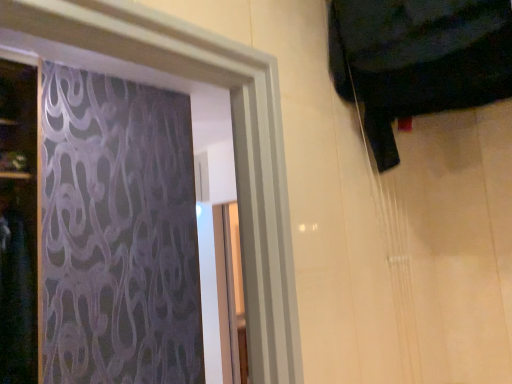
Question: Based on their positions, is black fabric at upper right located to the left or right of dark wood door at left?

Choices:
 (A) right
 (B) left

Answer: (A)

Question: Is point (434, 34) positioned closer to the camera than point (2, 132)?

Choices:
 (A) closer
 (B) farther

Answer: (A)

Question: From the image's perspective, relative to dark wood door at left, is black fabric at upper right above or below?

Choices:
 (A) above
 (B) below

Answer: (A)

Question: In terms of width, does dark wood door at left look wider or thinner when compared to black fabric at upper right?

Choices:
 (A) wide
 (B) thin

Answer: (A)

Question: In the image, is dark wood door at left on the left side or the right side of black fabric at upper right?

Choices:
 (A) left
 (B) right

Answer: (A)

Question: From the image's perspective, relative to black fabric at upper right, is dark wood door at left above or below?

Choices:
 (A) below
 (B) above

Answer: (A)

Question: In the image, is dark wood door at left positioned in front of or behind black fabric at upper right?

Choices:
 (A) behind
 (B) front

Answer: (A)